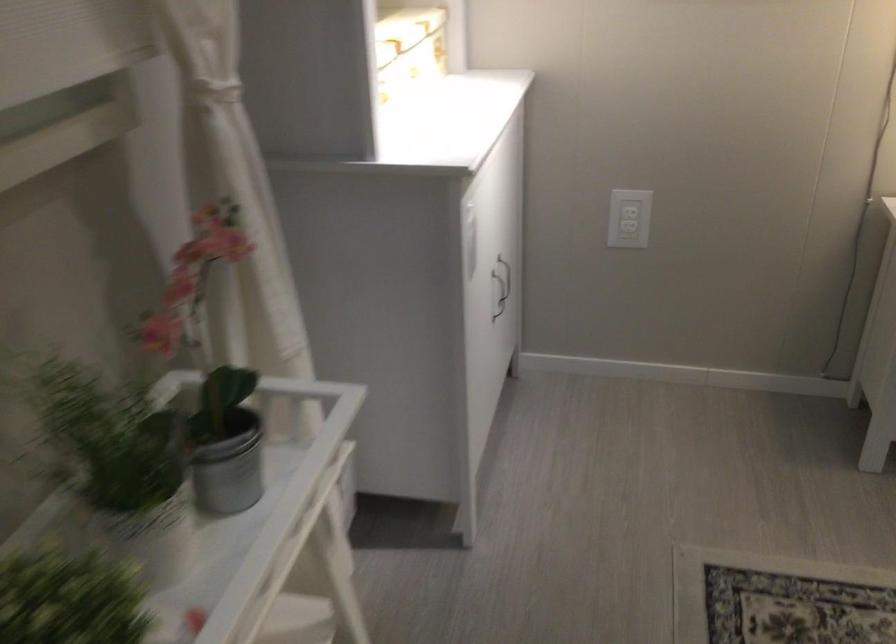
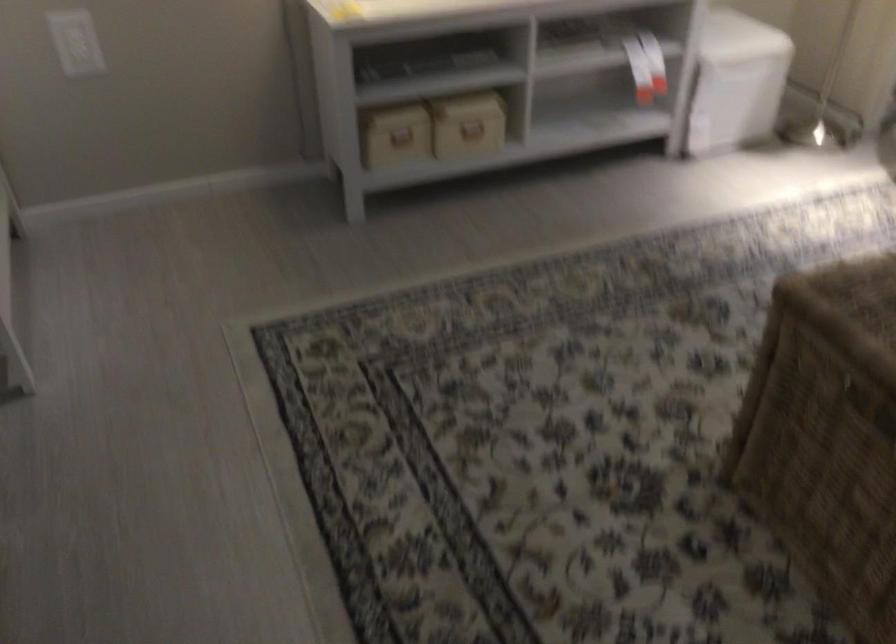
Where in the second image is the point corresponding to (x=626, y=205) from the first image?

(75, 42)